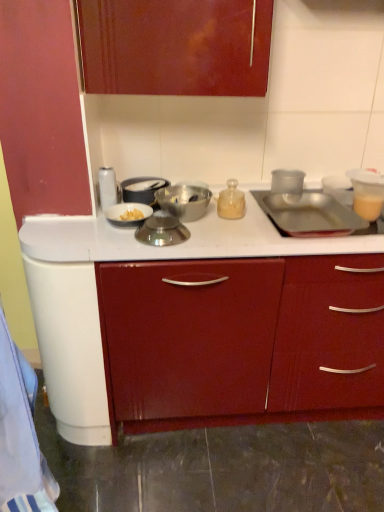
Locate an element on the screen. The image size is (384, 512). vacant space in front of metallic bowl at center, the 3th kitchen appliance viewed from the right is located at coordinates (193, 244).